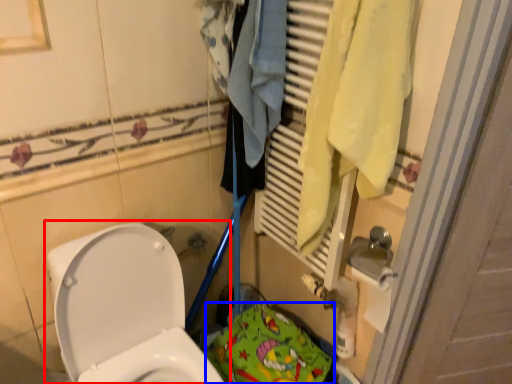
Question: Which point is further to the camera, toilet (highlighted by a red box) or material (highlighted by a blue box)?

Choices:
 (A) toilet
 (B) material

Answer: (B)